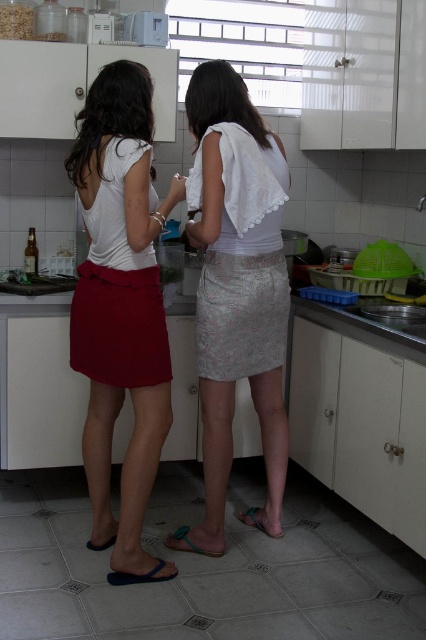
You are a chef who needs to move a 10 inch platter from the matte red skirt at left to the white lace skirt at center. Can you move it directly without needing to adjust the skirts?

The matte red skirt at left is 12.77 inches away from the white lace skirt at center. Since the platter is 10 inches in diameter, there is enough space between them to move it directly without adjusting the skirts.

You are a fashion designer observing two skirts in a kitchen scene. The matte red skirt at left and the white lace skirt at center are part of the outfits. Which skirt is positioned lower in the image?

The matte red skirt at left is below the white lace skirt at center, so the matte red skirt at left is positioned lower in the image.

You are standing in the kitchen and want to place a new red vase on the counter. The existing red items are the red skirt at left and the teal flip flops at right. Which existing red item is closer to the point where you want to place the vase, located at coordinate point (120, 308)?

The point where you want to place the vase is at coordinate point (120, 308), which is exactly where the matte red skirt at left is represented by point (120, 308). Therefore, the red skirt at left is at the exact location of the desired placement point.